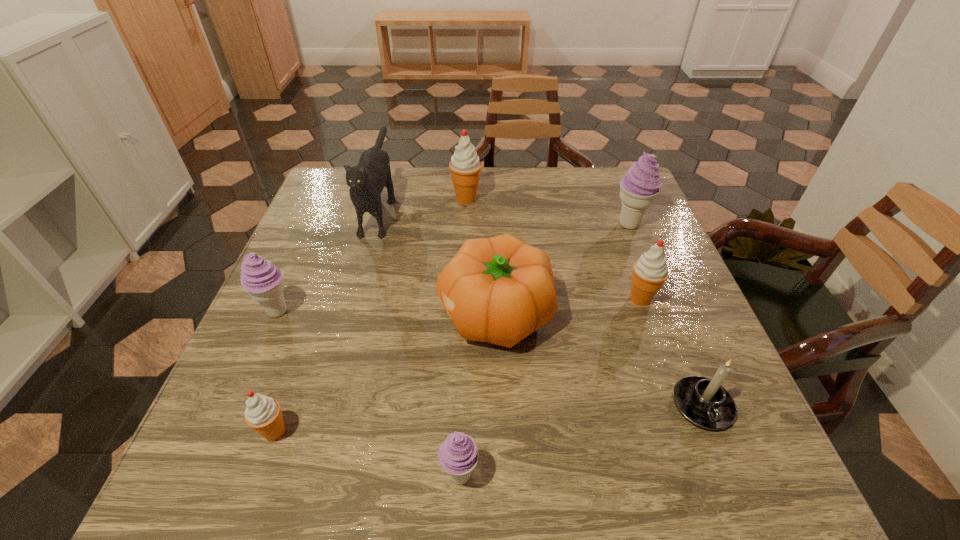
Where is `vacant space that's between the seventh object from right to left and the biggest red icecream`? vacant space that's between the seventh object from right to left and the biggest red icecream is located at coordinates (423, 201).

Find the location of a particular element. This screenshot has height=540, width=960. unoccupied position between the farthest purple icecream and the farthest red icecream is located at coordinates (547, 211).

Locate an element on the screen. free space between the fifth icecream from right to left and the cat is located at coordinates (327, 318).

The image size is (960, 540). In order to click on vacant region between the nearest red icecream and the pumpkin in this screenshot , I will do click(x=385, y=373).

The width and height of the screenshot is (960, 540). Find the location of `vacant area that lies between the farthest red icecream and the second icecream from left to right`. vacant area that lies between the farthest red icecream and the second icecream from left to right is located at coordinates (371, 315).

The width and height of the screenshot is (960, 540). I want to click on vacant area that lies between the pumpkin and the seventh object from right to left, so click(x=438, y=259).

At what (x,y) coordinates should I click in order to perform the action: click on vacant space that's between the candle holder and the second object from left to right. Please return your answer as a coordinate pair (x, y). Looking at the image, I should click on (489, 418).

Image resolution: width=960 pixels, height=540 pixels. What are the coordinates of `empty location between the farthest purple icecream and the pumpkin` in the screenshot? It's located at (562, 269).

Point out which object is positioned as the fourth nearest to the rightmost purple icecream. Please provide its 2D coordinates. Your answer should be formatted as a tuple, i.e. [(x, y)], where the tuple contains the x and y coordinates of a point satisfying the conditions above.

[(704, 402)]

Locate which object is the closest to the second object from left to right. Please provide its 2D coordinates. Your answer should be formatted as a tuple, i.e. [(x, y)], where the tuple contains the x and y coordinates of a point satisfying the conditions above.

[(260, 278)]